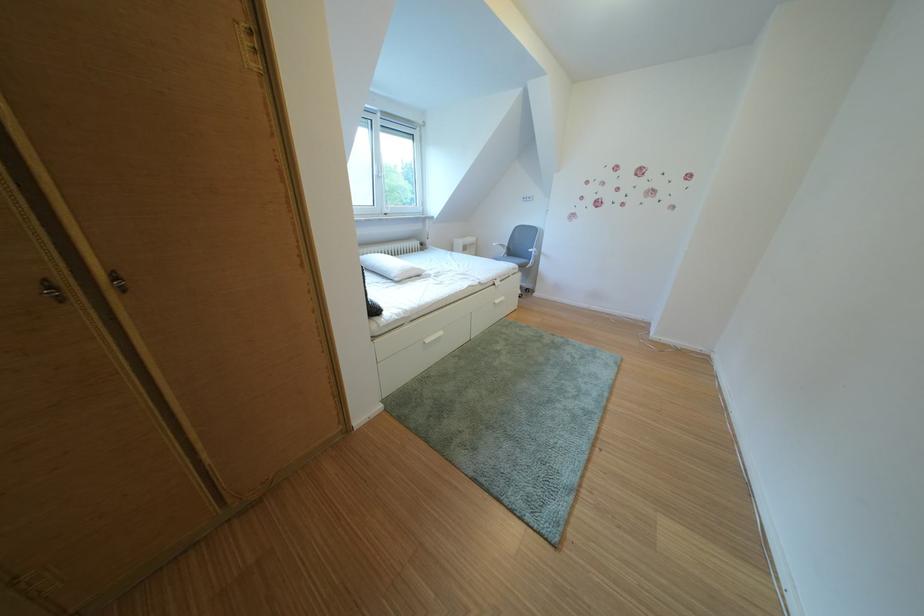
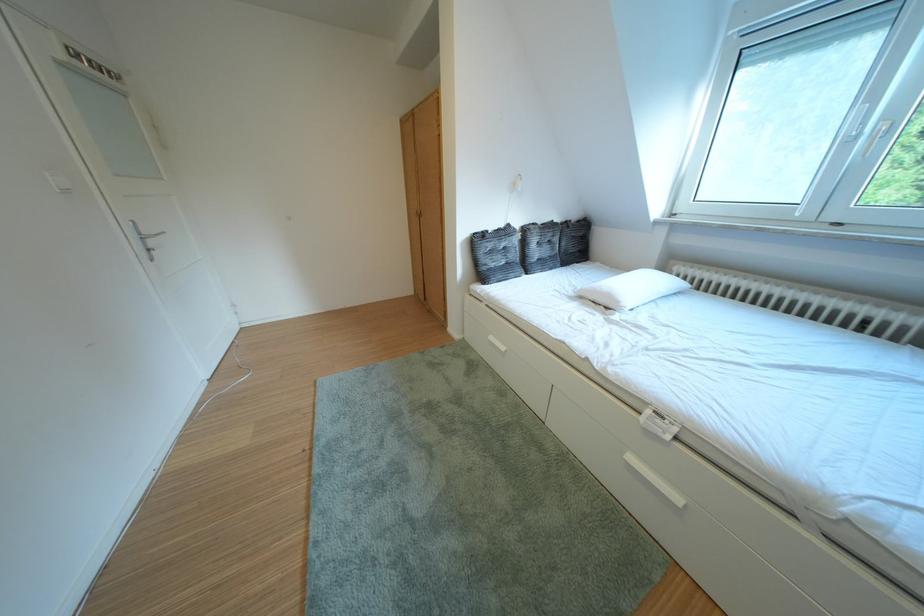
Find the pixel in the second image that matches point 511,307 in the first image.

(646, 464)